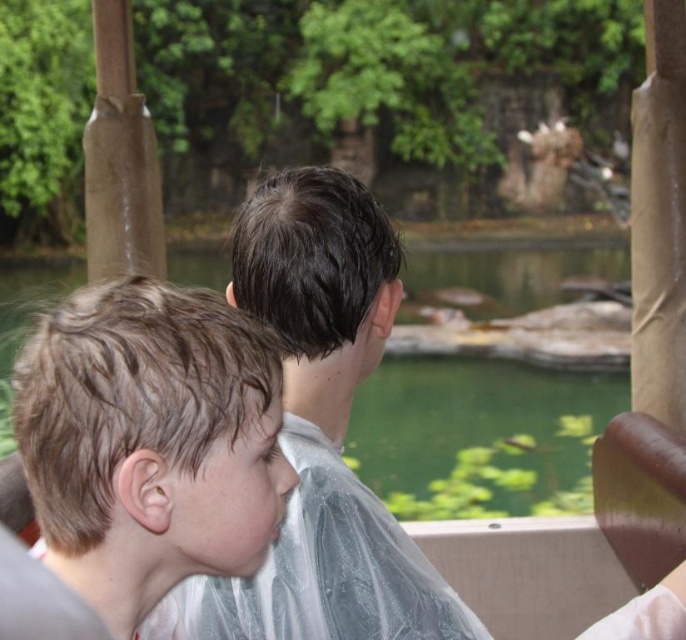
You are a photographer trying to capture a candid shot of the children at the zoo. You want to position your camera so that the light brown hair at left is centered in the frame. What coordinate should you aim for?

The light brown hair at left is located at coordinate point (150,442), so you should aim your camera at that coordinate to center it in the frame.